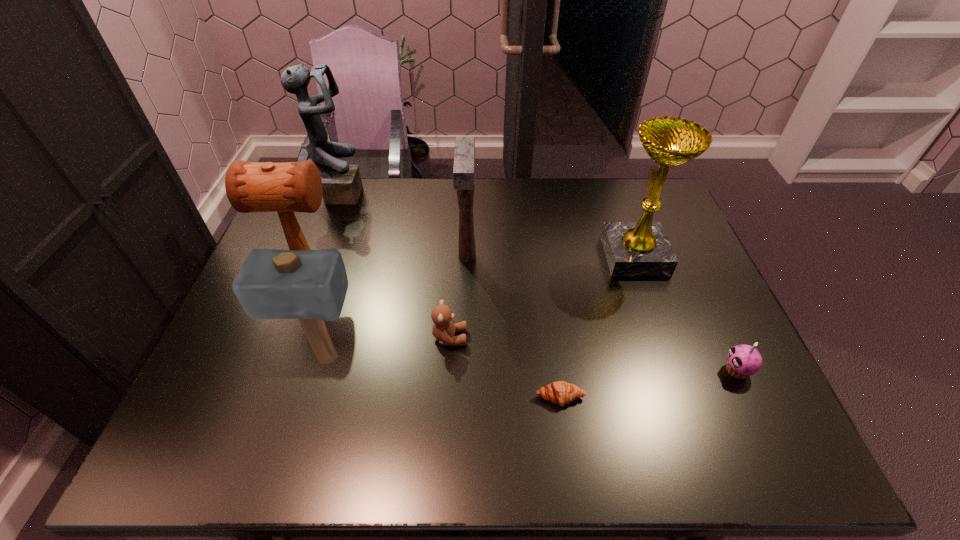
Locate an element on the screen. The image size is (960, 540). vacant region located on the front-facing side of the second object from right to left is located at coordinates (481, 255).

Identify the location of vacant space located 0.070m on the front-facing side of the second object from right to left. This screenshot has height=540, width=960. (582, 255).

You are a GUI agent. You are given a task and a screenshot of the screen. Output one action in this format:
    pyautogui.click(x=<x>, y=<y>)
    Task: Click on the vacant region located 0.090m on the back of the rightmost mallet
    The image size is (960, 540).
    Given the screenshot: What is the action you would take?
    pyautogui.click(x=468, y=220)

What are the coordinates of `vacant region located on the back of the nearest mallet` in the screenshot? It's located at (357, 251).

Locate an element on the screen. Image resolution: width=960 pixels, height=540 pixels. vacant region located on the face of the teddy bear is located at coordinates (518, 338).

Locate an element on the screen. The image size is (960, 540). vacant area situated 0.130m on the face of the rightmost object is located at coordinates (667, 370).

At what (x,y) coordinates should I click in order to perform the action: click on vacant point located on the face of the rightmost object. Please return your answer as a coordinate pair (x, y). The width and height of the screenshot is (960, 540). Looking at the image, I should click on (616, 370).

Where is `vacant position located on the face of the rightmost object`? Image resolution: width=960 pixels, height=540 pixels. vacant position located on the face of the rightmost object is located at coordinates (x=650, y=370).

Find the location of `free spot located on the front-facing side of the shortest object`. free spot located on the front-facing side of the shortest object is located at coordinates (565, 440).

The height and width of the screenshot is (540, 960). Find the location of `object at the far edge`. object at the far edge is located at coordinates (341, 183).